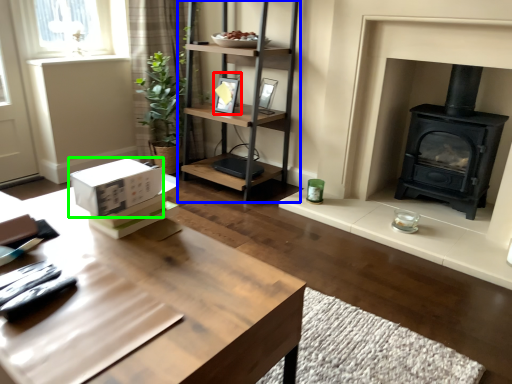
Question: Considering the real-world distances, which object is closest to picture frame (highlighted by a red box)? shelf (highlighted by a blue box) or cardboard box (highlighted by a green box).

Choices:
 (A) shelf
 (B) cardboard box

Answer: (A)